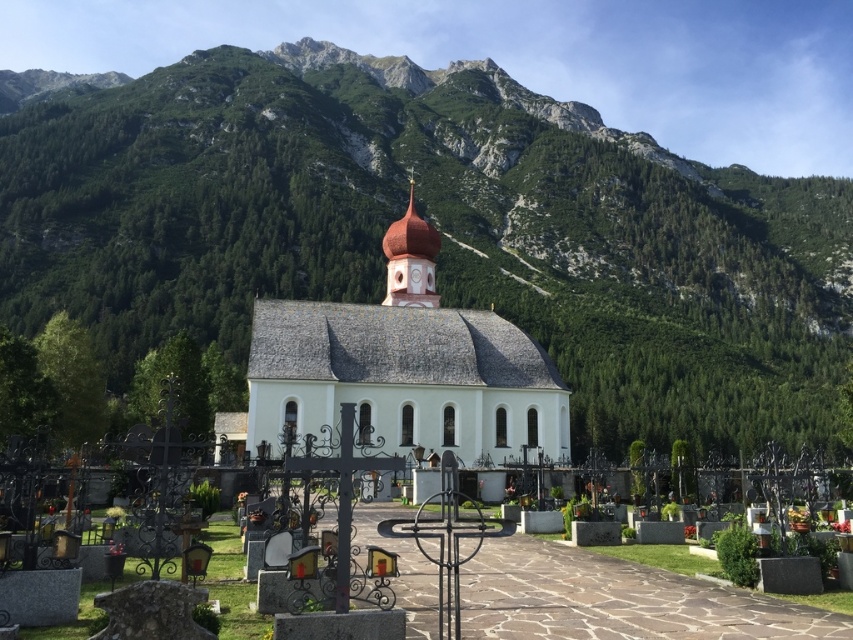
You are standing in the mountainous area and want to take a photo of the white stone church at center and the smooth white steeple at center. Which object should you focus on first to ensure both are in the frame?

The white stone church at center is positioned under the smooth white steeple at center, so you should focus on the smooth white steeple at center first to ensure both are in the frame.

You are standing in front of the church and want to take a photo that includes both the point at coordinates point (396, 124) and point (421, 241). Which point should you focus on first to ensure both are in focus?

You should focus on point (396, 124) first because it is closer to the camera than point (421, 241), ensuring both points are within the depth of field.

You are standing at the base of the green forested mountain at upper center and want to walk directly to the smooth white steeple at center. How far will you have to walk?

The green forested mountain at upper center is 103.30 meters from the smooth white steeple at center, so you will have to walk 103.30 meters to reach the steeple.